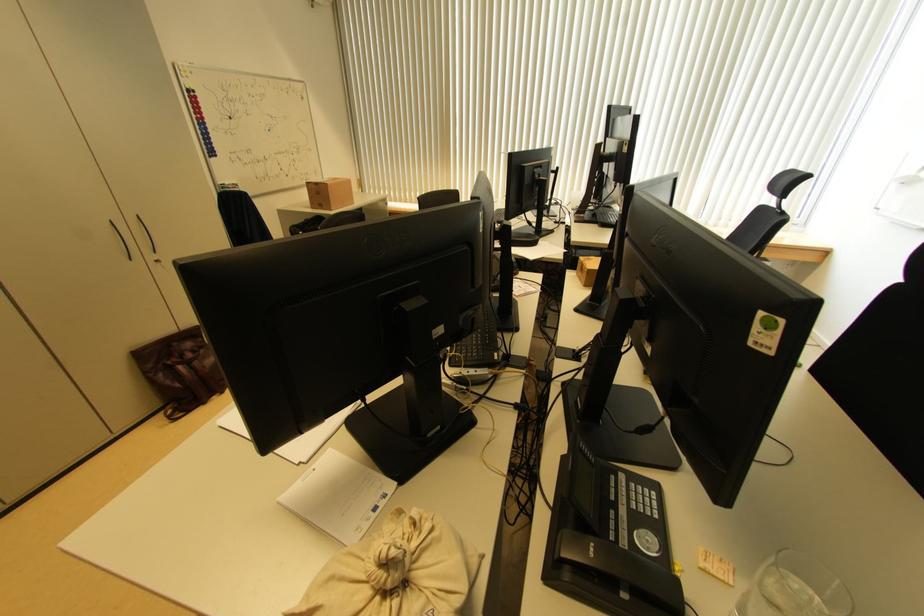
You are a GUI agent. You are given a task and a screenshot of the screen. Output one action in this format:
    pyautogui.click(x=<x>, y=<y>)
    Task: Click on the phone handset
    This screenshot has width=924, height=616.
    Given the screenshot: What is the action you would take?
    pyautogui.click(x=622, y=567)